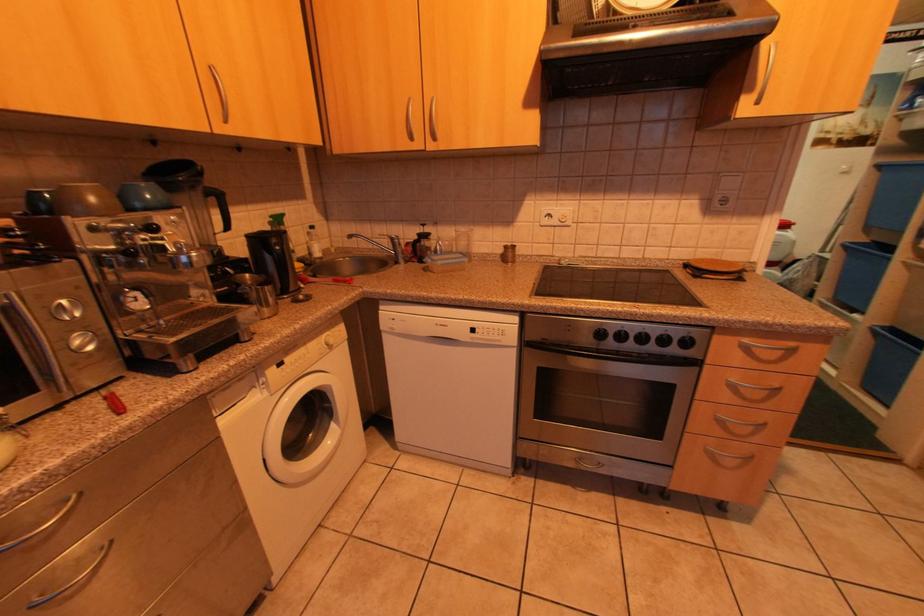
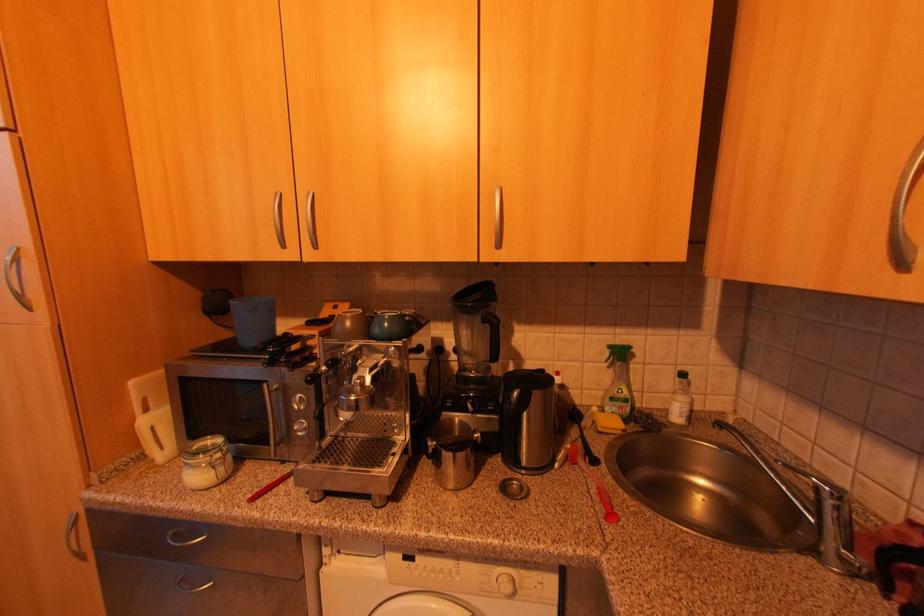
Question: The first image is from the beginning of the video and the second image is from the end. How did the camera likely rotate when shooting the video?

Choices:
 (A) Left
 (B) Right
 (C) Up
 (D) Down

Answer: (A)